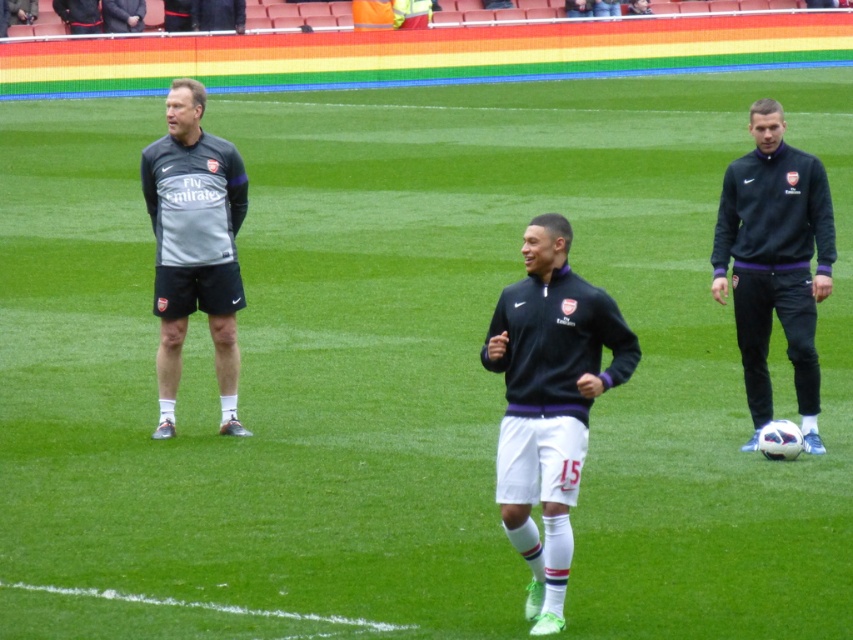
You are a soccer coach observing the training session. You need to quickly identify the positions of the dark blue jersey at right and the gray matte jacket at left. Which one is located to the right of the other?

The dark blue jersey at right is positioned on the right side of the gray matte jacket at left.

You are a photographer positioned at the edge of the soccer field. You want to take a photo of the black matte jacket at center and the gray matte jacket at left. Which jacket should you focus on first to ensure both are in sharp focus?

The black matte jacket at center is closer to the viewer than the gray matte jacket at left. To ensure both are in sharp focus, you should focus on the gray matte jacket at left first since it is farther away, allowing the depth of field to cover both subjects.

In the scene shown: You are a photographer positioned at the center of the soccer field. You need to capture a photo that includes both the dark blue jersey at right and the gray matte jacket at left. Considering their sizes, which object should you zoom in on more to ensure both are clearly visible in the frame?

The dark blue jersey at right is larger in size than the gray matte jacket at left. To ensure both are clearly visible, you should zoom in slightly more on the gray matte jacket at left so that its smaller size can be captured adequately while still framing the larger dark blue jersey at right properly.